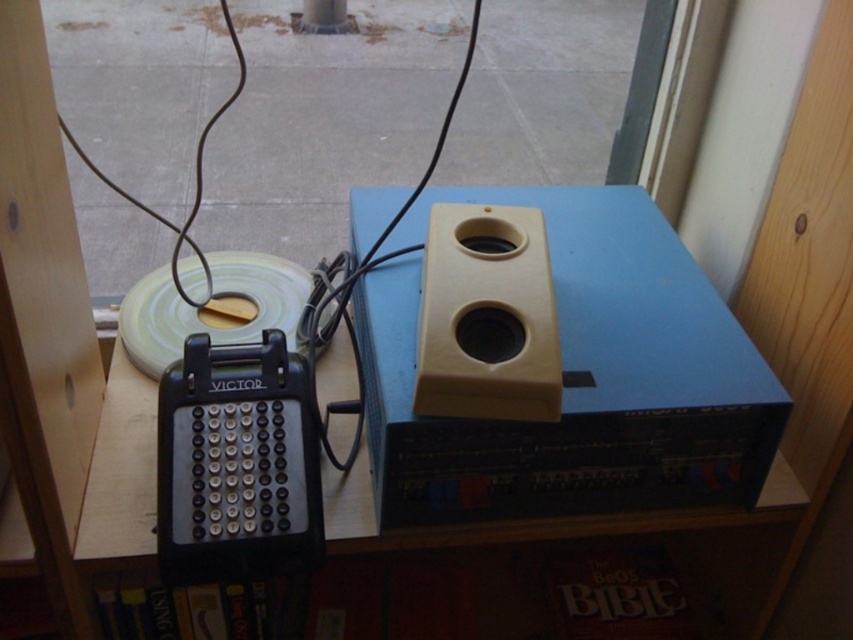
Consider the image. Is beige plastic speaker at center positioned behind wooden table at center?

No, it is in front of wooden table at center.

Does beige plastic speaker at center have a larger size compared to wooden table at center?

Incorrect, beige plastic speaker at center is not larger than wooden table at center.

Is point (486, 417) closer to viewer compared to point (354, 548)?

Yes, it is in front of point (354, 548).

At what (x,y) coordinates should I click in order to perform the action: click on beige plastic speaker at center. Please return your answer as a coordinate pair (x, y). Looking at the image, I should click on (486, 316).

Who is positioned more to the right, beige plastic speaker at upper center or white matte tape at center?

beige plastic speaker at upper center is more to the right.

Which is in front, point (711, 369) or point (299, 282)?

Point (711, 369) is in front.

I want to click on beige plastic speaker at upper center, so click(x=577, y=380).

Which is in front, point (618, 458) or point (454, 376)?

Point (454, 376) is in front.

Identify the location of beige plastic speaker at upper center. This screenshot has height=640, width=853. (577, 380).

This screenshot has height=640, width=853. I want to click on beige plastic speaker at upper center, so click(x=577, y=380).